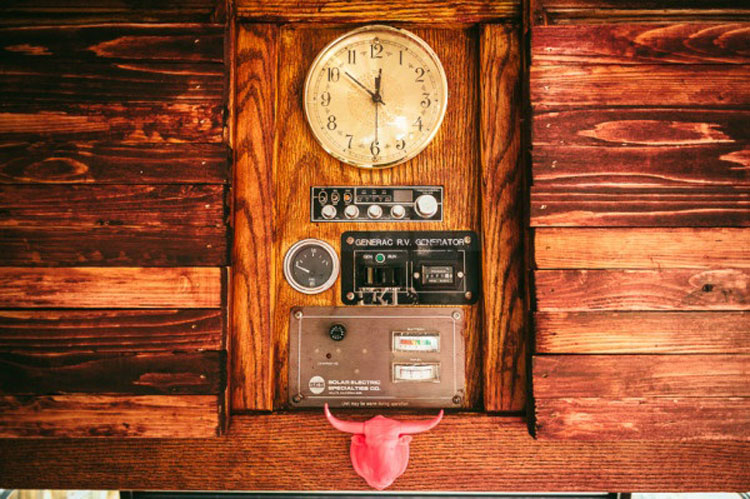
I want to click on knob, so click(429, 208).